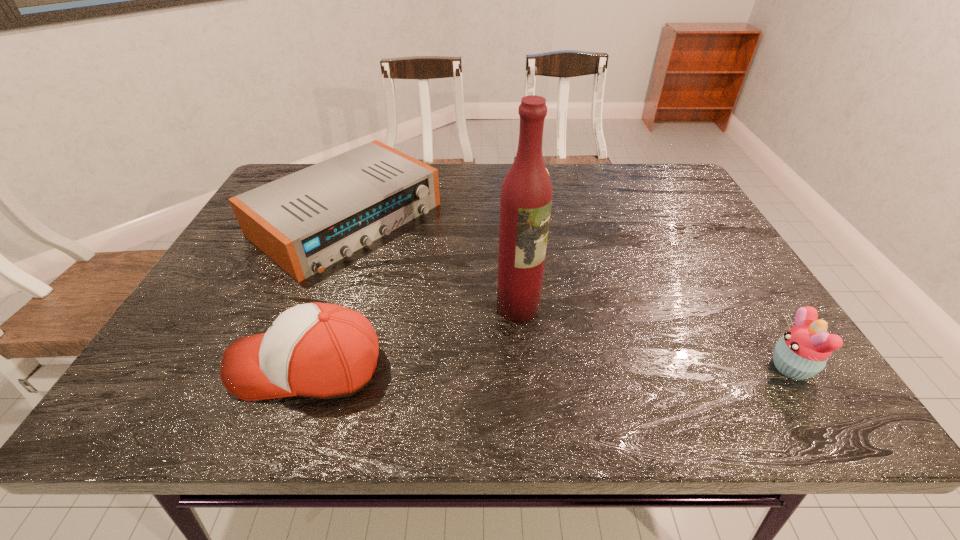
What are the coordinates of `object that is at the near right corner` in the screenshot? It's located at (802, 352).

In the image, there is a desktop. Identify the location of vacant space at the far edge. The height and width of the screenshot is (540, 960). (597, 185).

In the image, there is a desktop. Where is `vacant space at the left edge`? The image size is (960, 540). vacant space at the left edge is located at coordinates (222, 268).

Image resolution: width=960 pixels, height=540 pixels. In the image, there is a desktop. In order to click on vacant space at the right edge in this screenshot , I will do `click(708, 234)`.

Find the location of a particular element. The image size is (960, 540). free spot at the far right corner of the desktop is located at coordinates (645, 202).

I want to click on empty location between the liquor and the baseball cap, so click(x=413, y=337).

This screenshot has width=960, height=540. Identify the location of free space between the third nearest object and the cupcake. (654, 337).

The width and height of the screenshot is (960, 540). I want to click on empty space that is in between the third farthest object and the baseball cap, so click(x=413, y=337).

Locate an element on the screen. vacant area that lies between the baseball cap and the third nearest object is located at coordinates (413, 337).

Where is `free space between the liquor and the radio receiver`? The image size is (960, 540). free space between the liquor and the radio receiver is located at coordinates (432, 263).